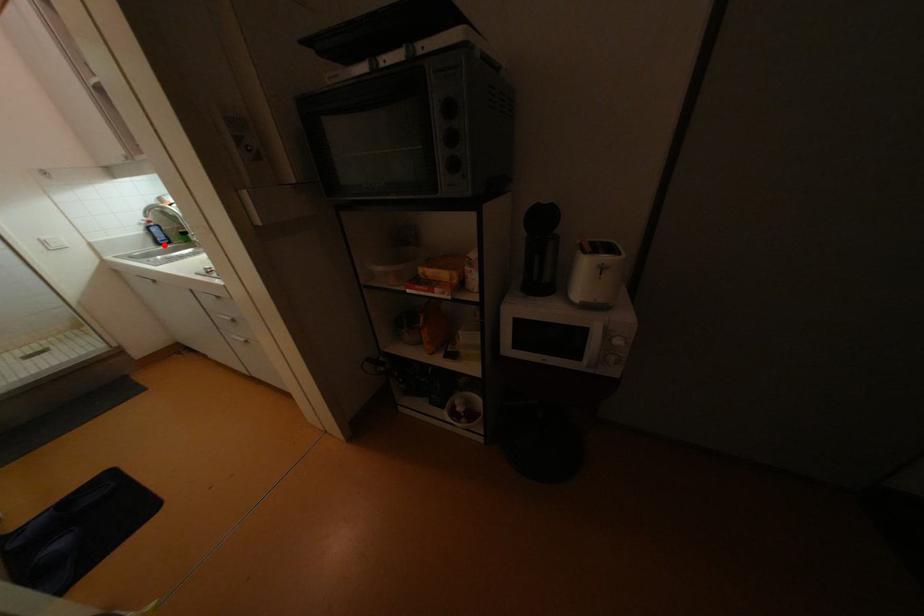
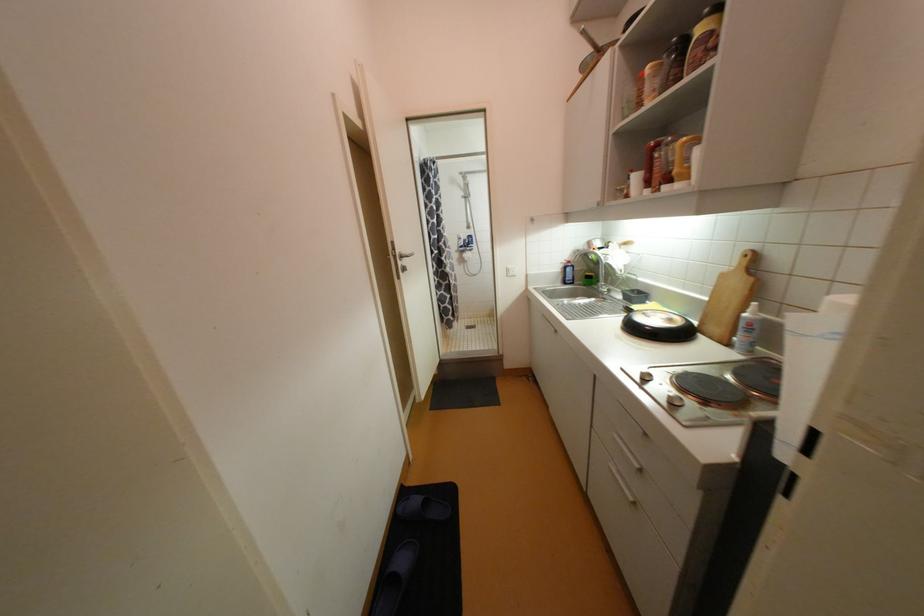
Locate, in the second image, the point that corresponds to the highlighted location in the first image.

(569, 283)